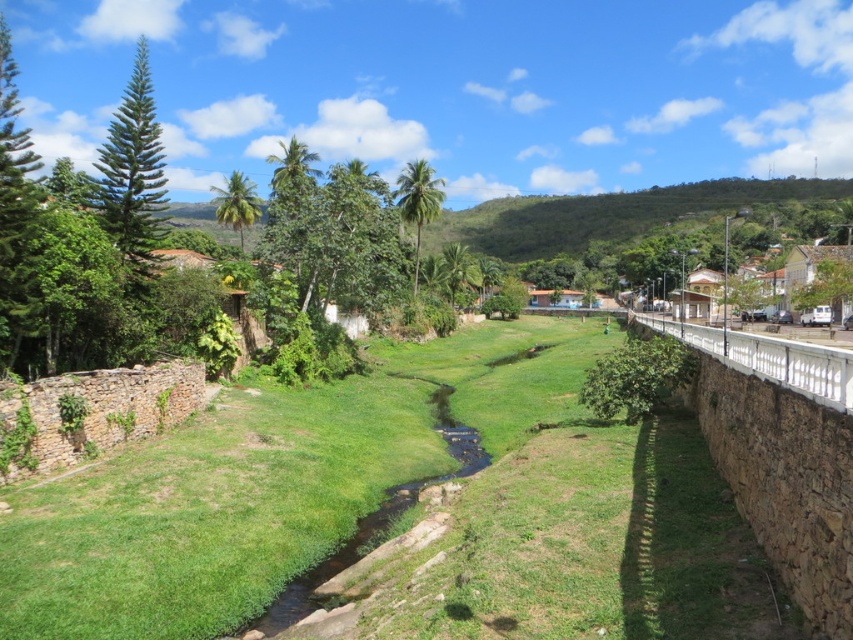
You are standing at point (386, 522) and want to walk to point (165, 436). According to the scene description, will you be moving towards the stream or away from it?

Since point (165, 436) is behind point (386, 522), moving from (386, 522) to (165, 436) means you are moving away from the stream.

You are planning to set up a picnic blanket in the center of the image. There are two areas with green grassy at center and green grassy creek at center. Which area is more elevated?

The green grassy at center is positioned over green grassy creek at center, so the green grassy at center is more elevated than the green grassy creek at center.